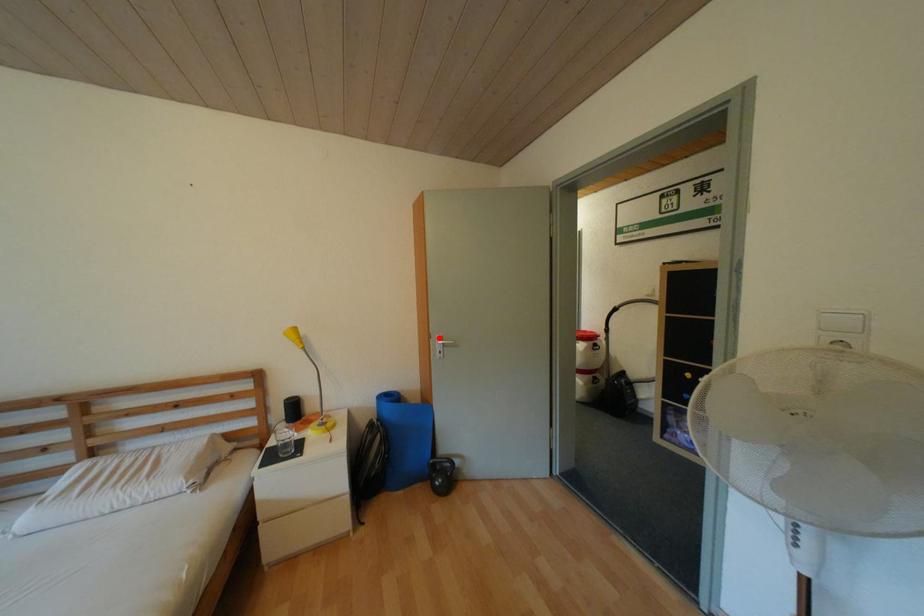
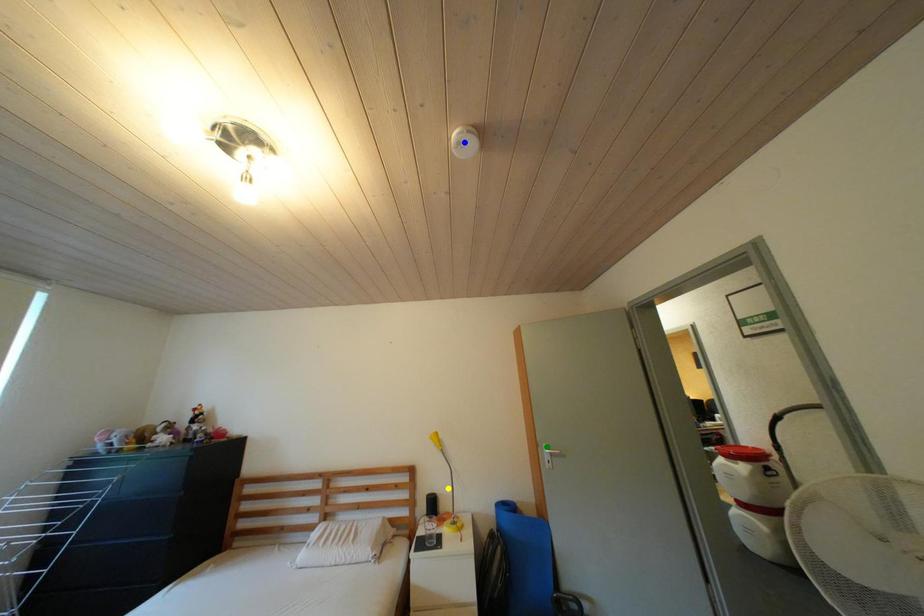
Question: I am providing you with two images of the same scene from different viewpoints. A red point is marked on the first image. You are given multiple points on the second image. Can you choose the point in image 2 that corresponds to the point in image 1?

Choices:
 (A) blue point
 (B) yellow point
 (C) green point

Answer: (C)